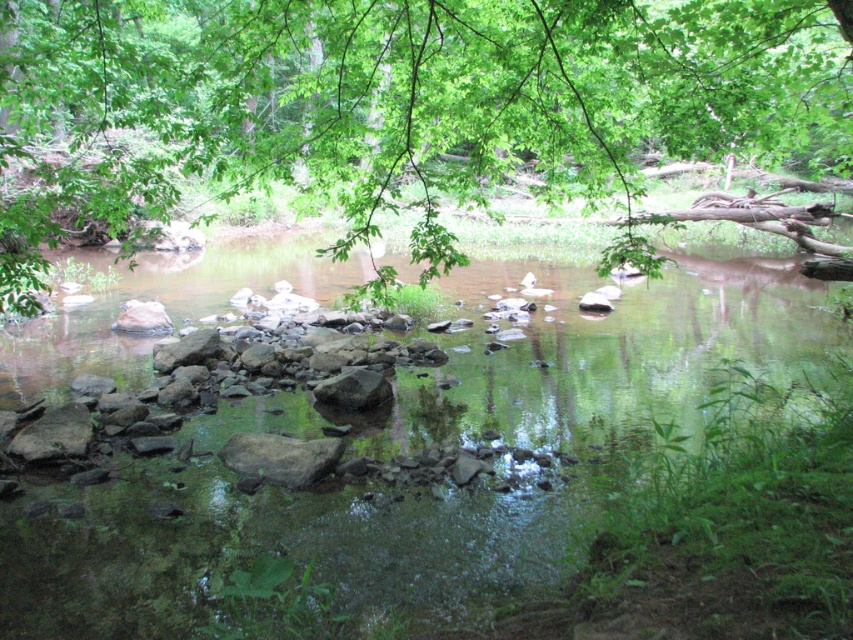
Question: Which point is farther to the camera?

Choices:
 (A) (254, 429)
 (B) (111, 38)
 (C) (320, 392)

Answer: (B)

Question: Which object is positioned closest to the smooth gray rock at center?

Choices:
 (A) green smooth water at center
 (B) green leafy branch at upper center

Answer: (A)

Question: Is green smooth water at center positioned at the back of green leafy branch at upper center?

Choices:
 (A) no
 (B) yes

Answer: (A)

Question: Among these objects, which one is nearest to the camera?

Choices:
 (A) green leafy branch at upper center
 (B) green smooth water at center
 (C) smooth gray rock at center

Answer: (B)

Question: Is green smooth water at center positioned before smooth gray rock at center?

Choices:
 (A) no
 (B) yes

Answer: (B)

Question: Is green leafy branch at upper center thinner than smooth gray rock at center?

Choices:
 (A) no
 (B) yes

Answer: (A)